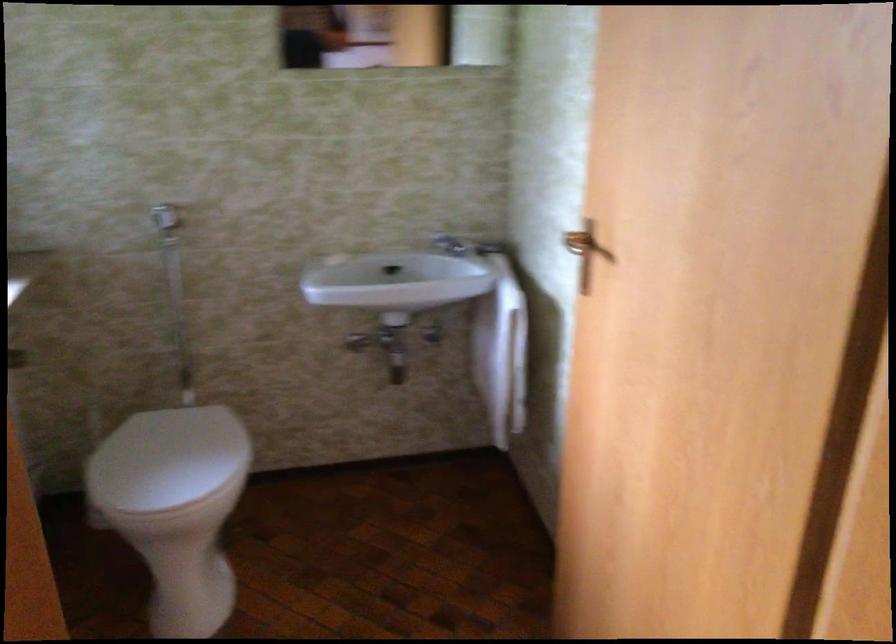
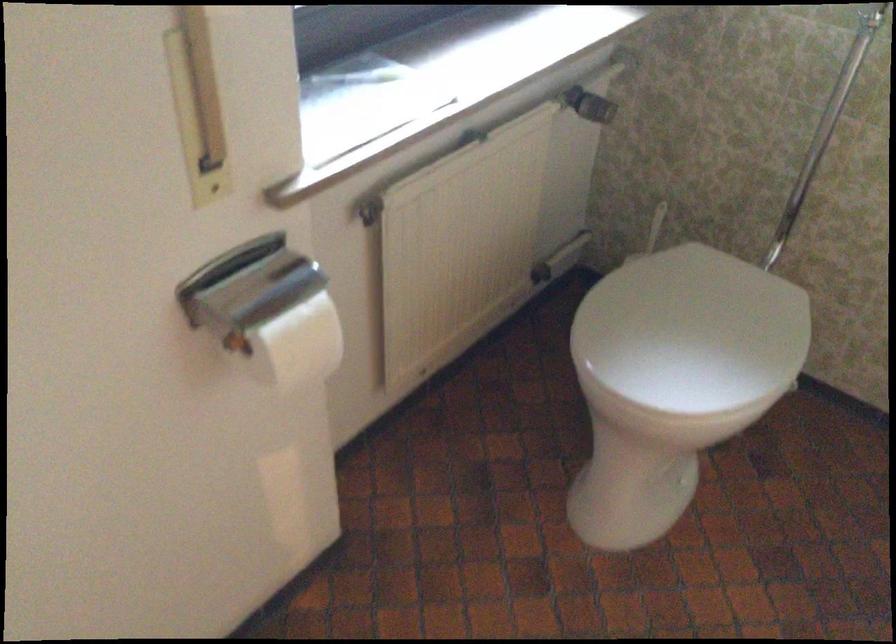
Locate, in the second image, the point that corresponds to the point at 183,460 in the first image.

(692, 330)